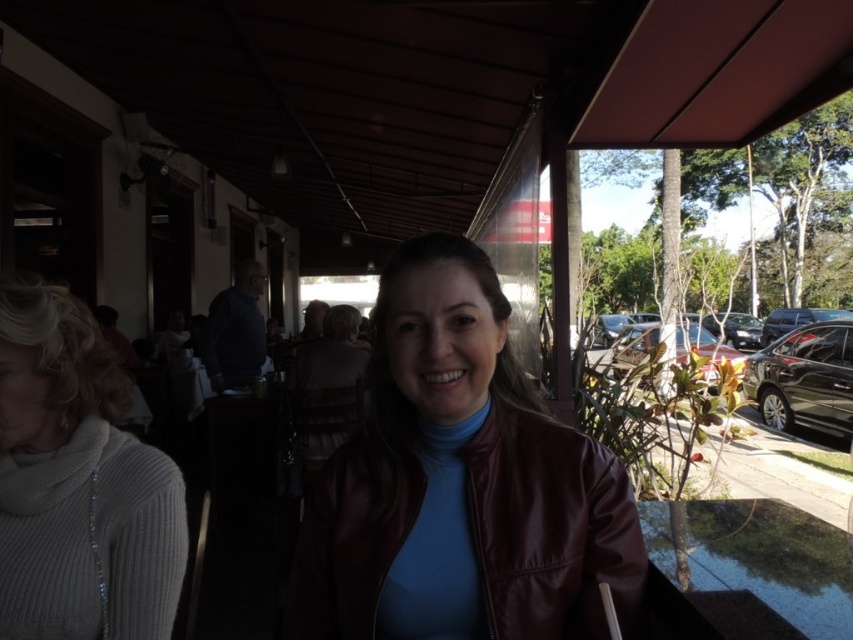
Question: Which point is farther from the camera taking this photo?

Choices:
 (A) (393, 422)
 (B) (679, 378)
 (C) (712, 518)

Answer: (B)

Question: Can you confirm if black glossy car at right is positioned above metallic silver car at center?

Choices:
 (A) no
 (B) yes

Answer: (A)

Question: Which point appears closest to the camera in this image?

Choices:
 (A) (422, 467)
 (B) (654, 344)
 (C) (36, 618)
 (D) (705, 380)

Answer: (A)

Question: Is white ribbed sweater at left closer to camera compared to metallic silver car at center?

Choices:
 (A) no
 (B) yes

Answer: (B)

Question: Which of the following is the closest to the observer?

Choices:
 (A) white ribbed sweater at left
 (B) burgundy leather jacket at center

Answer: (B)

Question: Considering the relative positions of burgundy leather jacket at center and black glossy car at right in the image provided, where is burgundy leather jacket at center located with respect to black glossy car at right?

Choices:
 (A) left
 (B) right

Answer: (A)